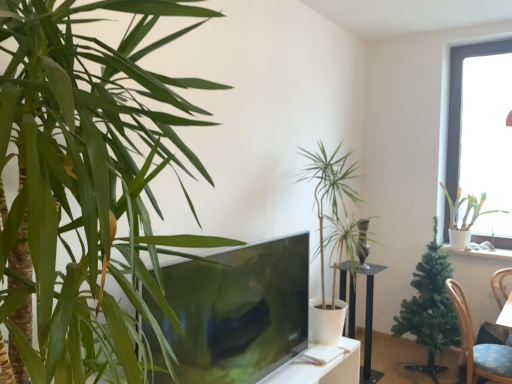
Question: Considering the relative sizes of transparent glass window at upper right and green leafy plant at center, which is the 3th houseplant from back to front, in the image provided, is transparent glass window at upper right taller than green leafy plant at center, which is the 3th houseplant from back to front,?

Choices:
 (A) no
 (B) yes

Answer: (B)

Question: Does transparent glass window at upper right have a greater width compared to green leafy plant at center, which appears as the 2th houseplant when viewed from the left?

Choices:
 (A) yes
 (B) no

Answer: (B)

Question: Are transparent glass window at upper right and green leafy plant at center, which appears as the 2th houseplant when viewed from the left, located far from each other?

Choices:
 (A) yes
 (B) no

Answer: (A)

Question: From the image's perspective, is transparent glass window at upper right on top of green leafy plant at center, the second houseplant from the front?

Choices:
 (A) yes
 (B) no

Answer: (A)

Question: Is transparent glass window at upper right facing away from green leafy plant at center, which appears as the 2th houseplant when viewed from the left?

Choices:
 (A) yes
 (B) no

Answer: (B)

Question: Considering the positions of transparent glass window at upper right and green leafy plant at left, the 1th houseplant from the front, in the image, is transparent glass window at upper right wider or thinner than green leafy plant at left, the 1th houseplant from the front,?

Choices:
 (A) wide
 (B) thin

Answer: (B)

Question: In the image, is transparent glass window at upper right on the left side or the right side of green leafy plant at left, the 4th houseplant from the back?

Choices:
 (A) left
 (B) right

Answer: (B)

Question: Considering the positions of point (x=510, y=79) and point (x=20, y=291), is point (x=510, y=79) closer or farther from the camera than point (x=20, y=291)?

Choices:
 (A) farther
 (B) closer

Answer: (A)

Question: In terms of height, does transparent glass window at upper right look taller or shorter compared to green leafy plant at left, the 4th houseplant from the back?

Choices:
 (A) short
 (B) tall

Answer: (B)

Question: Do you think transparent glass window at upper right is within white glossy pot at upper right, the first houseplant viewed from the right, or outside of it?

Choices:
 (A) outside
 (B) inside

Answer: (A)

Question: Is transparent glass window at upper right bigger or smaller than white glossy pot at upper right, the first houseplant in the back-to-front sequence?

Choices:
 (A) big
 (B) small

Answer: (B)

Question: From a real-world perspective, is transparent glass window at upper right positioned above or below white glossy pot at upper right, which appears as the 4th houseplant when viewed from the front?

Choices:
 (A) above
 (B) below

Answer: (A)

Question: Visually, is transparent glass window at upper right positioned to the left or to the right of white glossy pot at upper right, the first houseplant viewed from the right?

Choices:
 (A) left
 (B) right

Answer: (B)

Question: Looking at their shapes, would you say transparent glass window at upper right is wider or thinner than green artificial tree at right, arranged as the second houseplant when viewed from the right?

Choices:
 (A) thin
 (B) wide

Answer: (A)

Question: In the image, is transparent glass window at upper right positioned in front of or behind green artificial tree at right, the 3th houseplant positioned from the left?

Choices:
 (A) behind
 (B) front

Answer: (A)